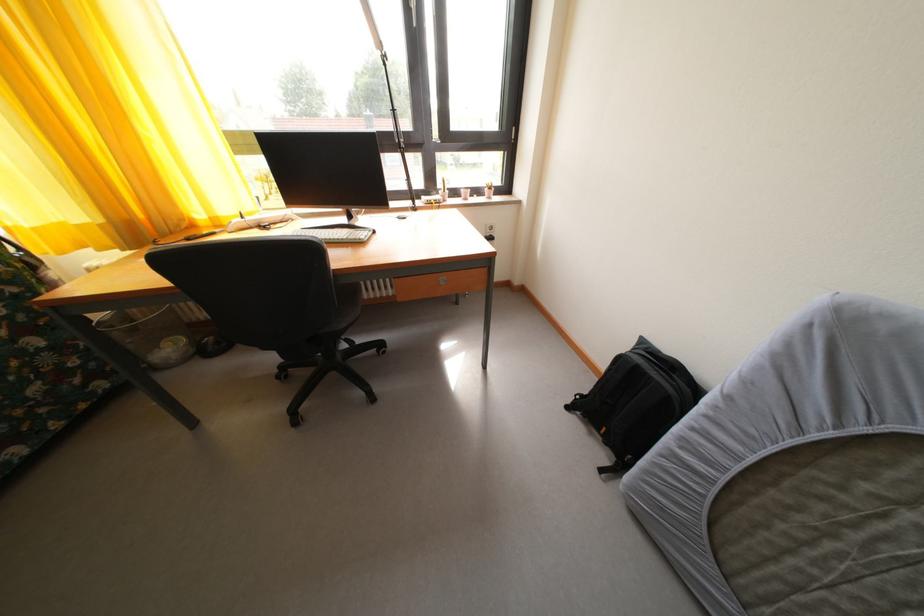
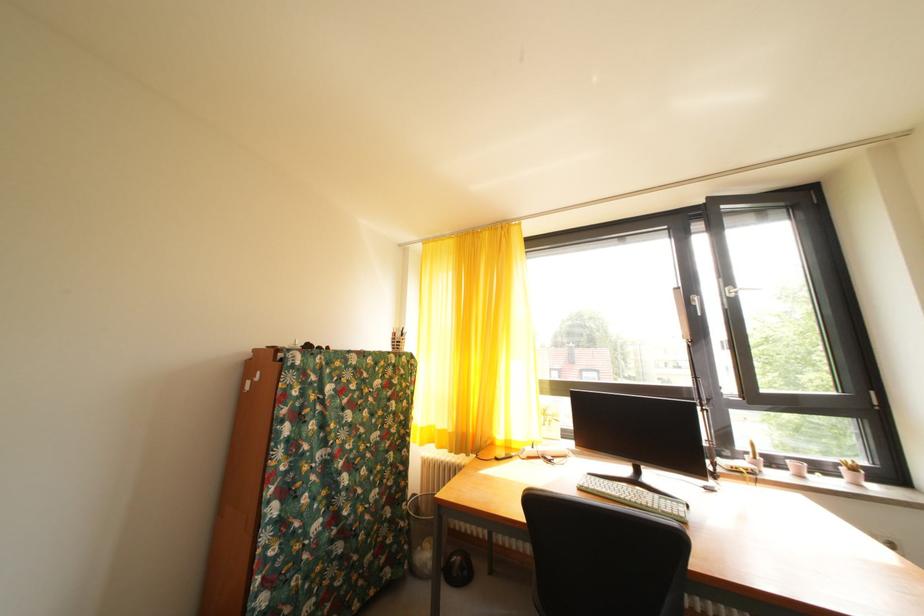
First-person continuous shooting, in which direction is the camera rotating?

The camera's rotation is toward left-up.